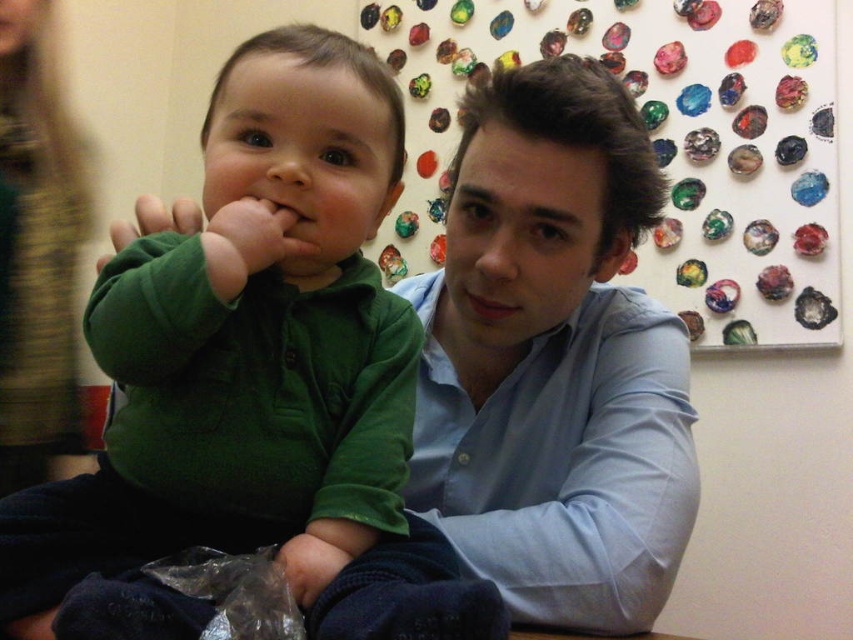
Between green soft fabric at center and matte green sweater at center, which one has more height?

With more height is green soft fabric at center.

Does green soft fabric at center have a greater width compared to matte green sweater at center?

Yes, green soft fabric at center is wider than matte green sweater at center.

Is point (241, 104) in front of point (305, 534)?

No, it is behind (305, 534).

Image resolution: width=853 pixels, height=640 pixels. Identify the location of green soft fabric at center. (286, 244).

Is light blue shirt at center bigger than green soft fabric at center?

Yes, light blue shirt at center is bigger than green soft fabric at center.

Who is more distant from viewer, [648,417] or [229,140]?

Point [648,417]

This screenshot has width=853, height=640. Find the location of `light blue shirt at center`. light blue shirt at center is located at coordinates (553, 358).

Locate an element on the screen. Image resolution: width=853 pixels, height=640 pixels. light blue shirt at center is located at coordinates (553, 358).

Between light blue shirt at center and matte green sweater at center, which one has more height?

light blue shirt at center

Which is behind, point (531, 426) or point (306, 573)?

Point (531, 426)

Which is behind, point (518, 445) or point (312, 554)?

The point (518, 445) is behind.

At what (x,y) coordinates should I click in order to perform the action: click on light blue shirt at center. Please return your answer as a coordinate pair (x, y). Looking at the image, I should click on (553, 358).